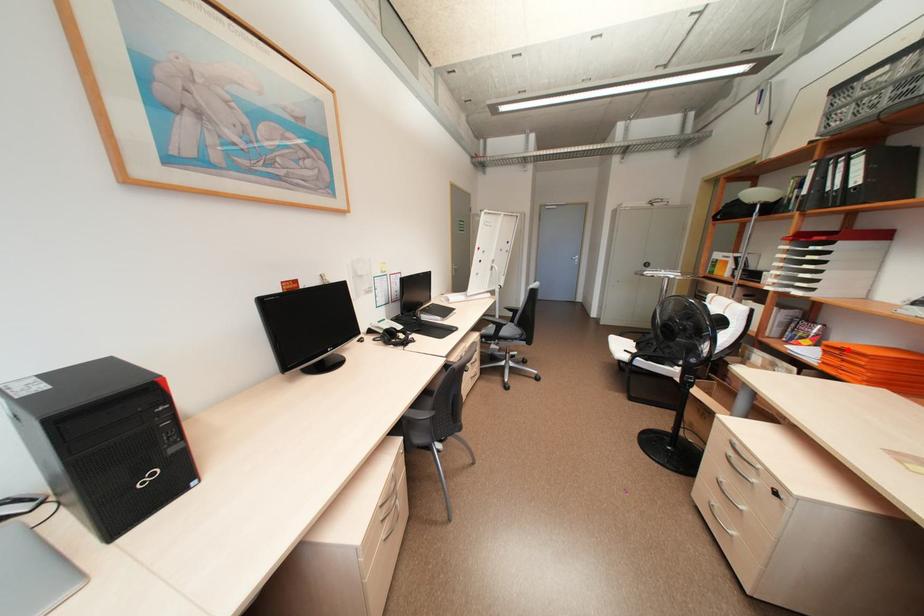
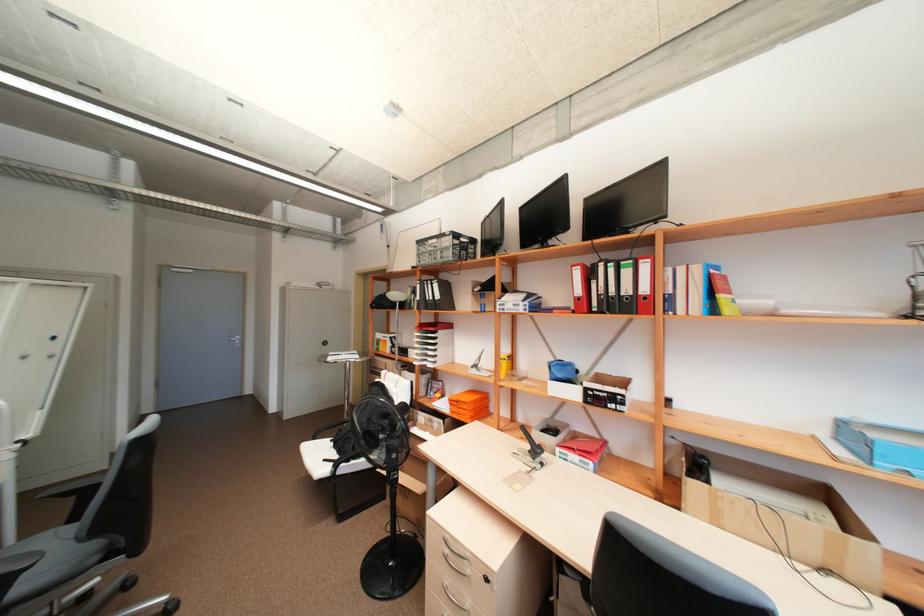
Question: I am providing you with two images of the same scene from different viewpoints. Image1 has a red point marked. In image2, the corresponding 3D location appears at what relative position? Reply with the corresponding letter.

Choices:
 (A) Closer
 (B) Farther

Answer: (B)